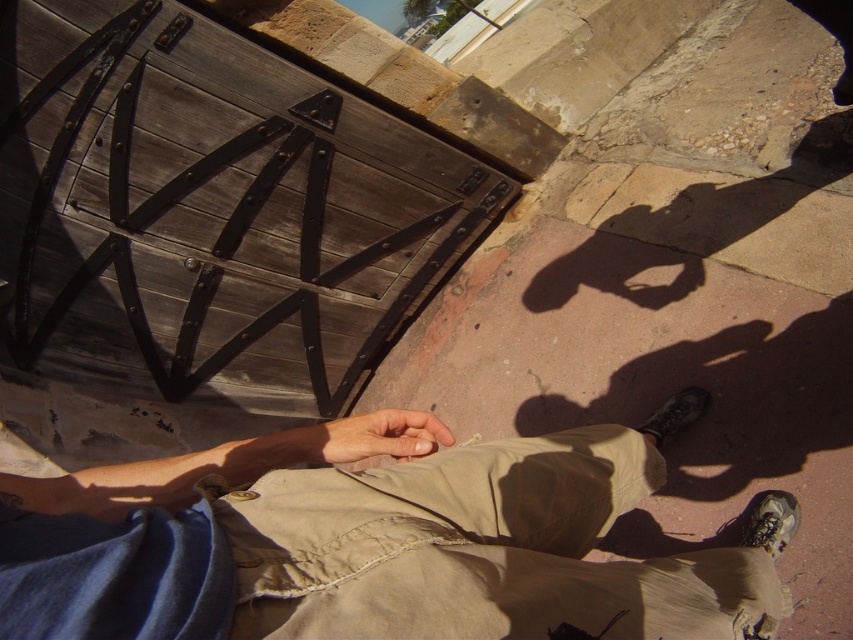
Question: Does khaki cotton pants at lower center appear on the left side of light brown leather hand at center?

Choices:
 (A) no
 (B) yes

Answer: (A)

Question: Which object appears closest to the camera in this image?

Choices:
 (A) light brown leather hand at center
 (B) black leather shoe at lower right
 (C) khaki cotton pants at lower center

Answer: (C)

Question: Does khaki cotton pants at lower center appear under black leather shoe at lower right?

Choices:
 (A) yes
 (B) no

Answer: (A)

Question: Which object appears closest to the camera in this image?

Choices:
 (A) matte gray shoe at lower right
 (B) black leather shoe at lower right
 (C) khaki cotton pants at lower center
 (D) light brown leather hand at center

Answer: (C)

Question: Is light brown leather hand at center above matte gray shoe at lower right?

Choices:
 (A) yes
 (B) no

Answer: (A)

Question: Which of the following is the farthest from the observer?

Choices:
 (A) (344, 456)
 (B) (656, 413)
 (C) (779, 531)

Answer: (B)